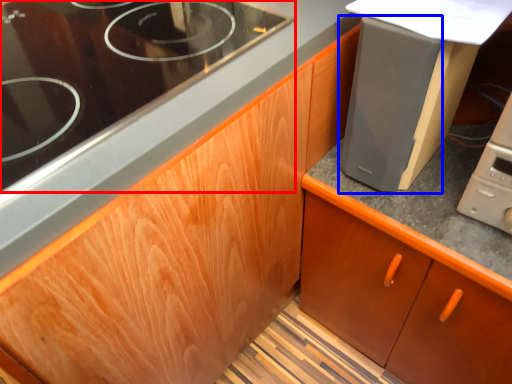
Question: Which object is further to the camera taking this photo, gas stove (highlighted by a red box) or appliance (highlighted by a blue box)?

Choices:
 (A) gas stove
 (B) appliance

Answer: (B)